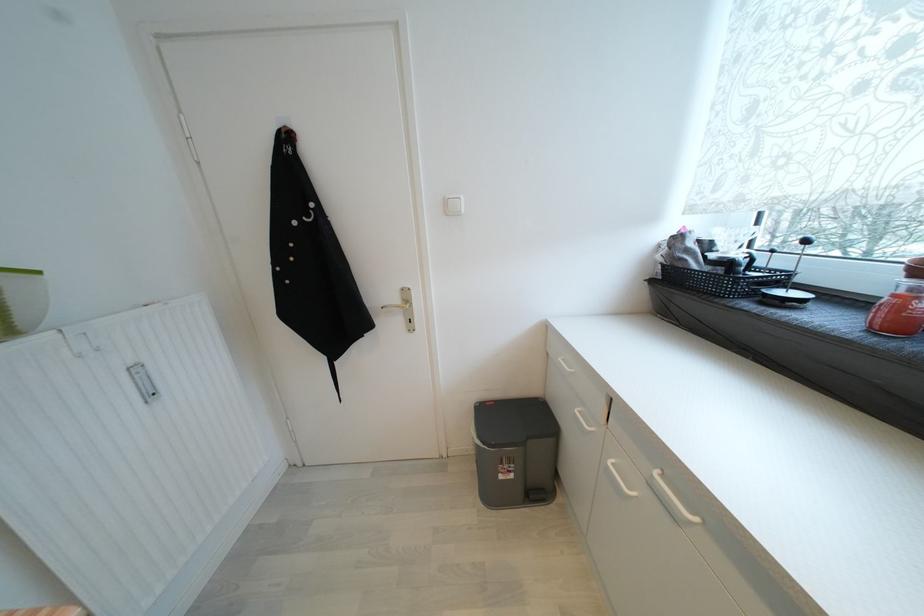
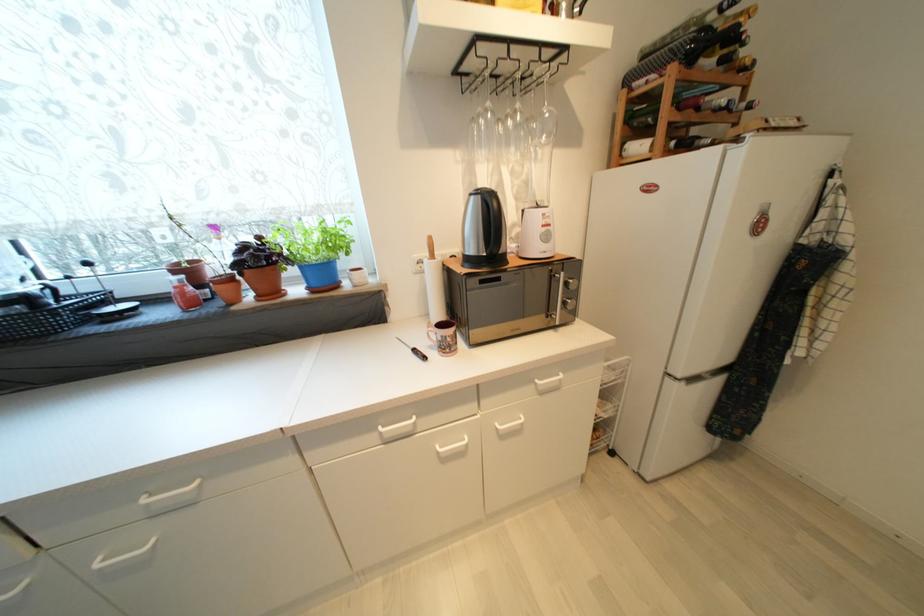
The images are taken continuously from a first-person perspective. In which direction is your viewpoint rotating?

The camera rotated toward right-down.